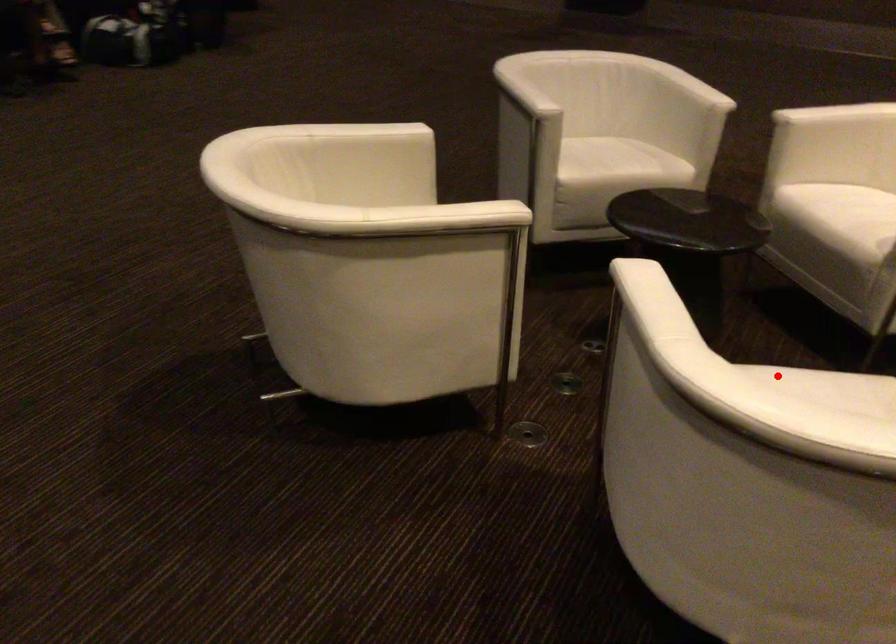
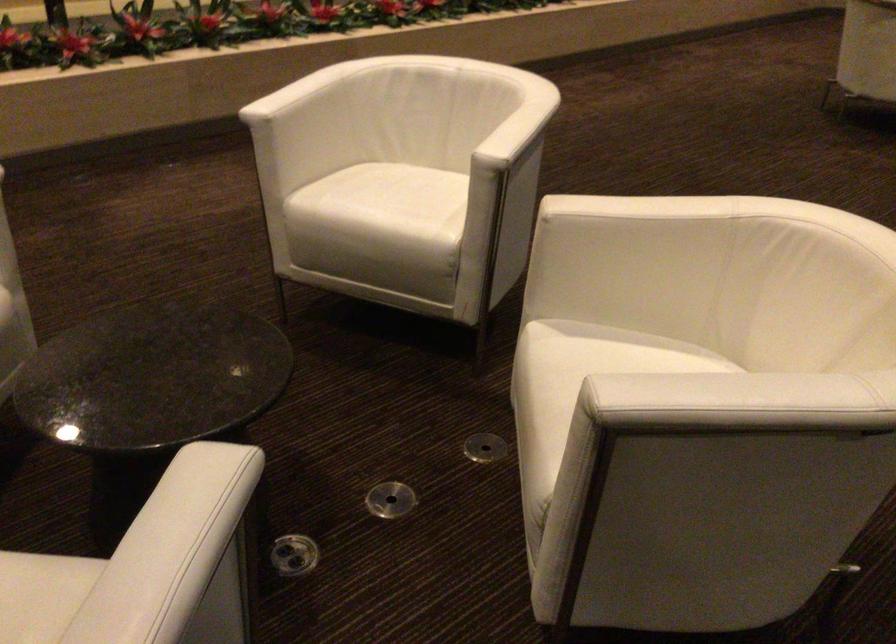
Where in the second image is the point corresponding to the highlighted location from the first image?

(383, 205)